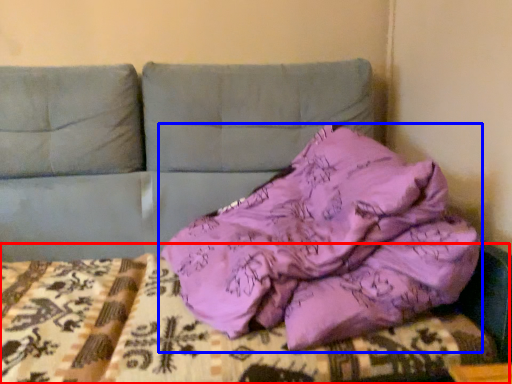
Question: Which object appears farthest to the camera in this image, bed frame (highlighted by a red box) or pillow (highlighted by a blue box)?

Choices:
 (A) bed frame
 (B) pillow

Answer: (A)